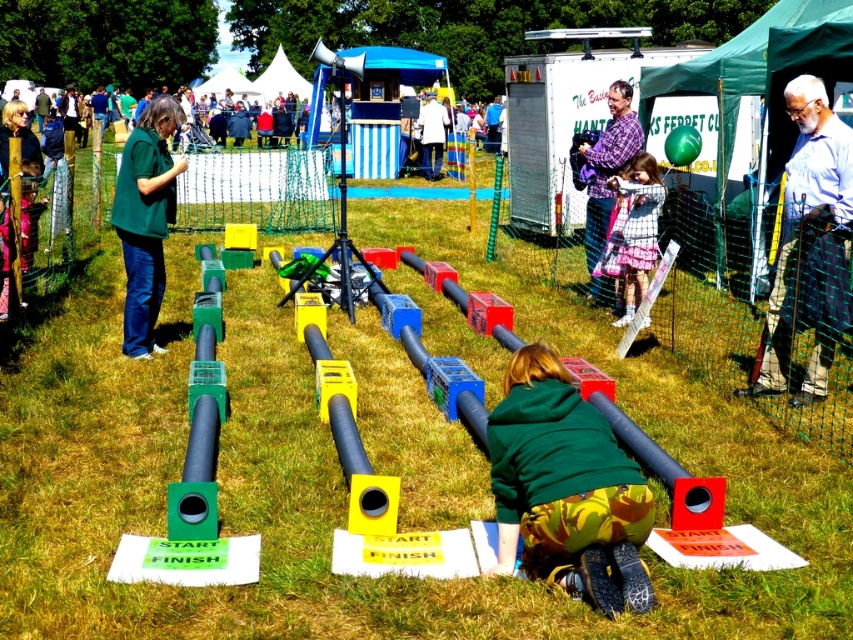
The image size is (853, 640). What do you see at coordinates (810, 244) in the screenshot?
I see `blue plaid kilt at right` at bounding box center [810, 244].

Is the position of blue plaid kilt at right less distant than that of plaid fabric dress at center?

Yes, it is.

Identify the location of blue plaid kilt at right. The height and width of the screenshot is (640, 853). (810, 244).

Image resolution: width=853 pixels, height=640 pixels. What do you see at coordinates (634, 230) in the screenshot? I see `plaid fabric dress at center` at bounding box center [634, 230].

Where is `plaid fabric dress at center`? plaid fabric dress at center is located at coordinates (634, 230).

Which is below, green matte jacket at left or green fabric jacket at center?

green matte jacket at left

Which is behind, point (142, 186) or point (422, 120)?

The point (422, 120) is more distant.

This screenshot has width=853, height=640. What are the coordinates of `green matte jacket at left` in the screenshot? It's located at (144, 218).